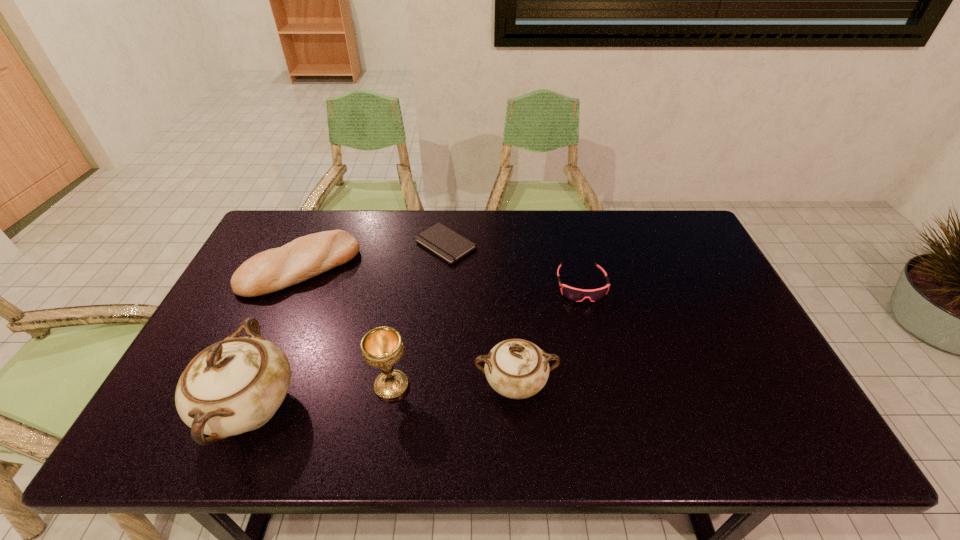
The image size is (960, 540). Identify the location of free point that satisfies the following two spatial constraints: 1. on the front side of the third shortest object; 2. on the right side of the right chinaware. (249, 384).